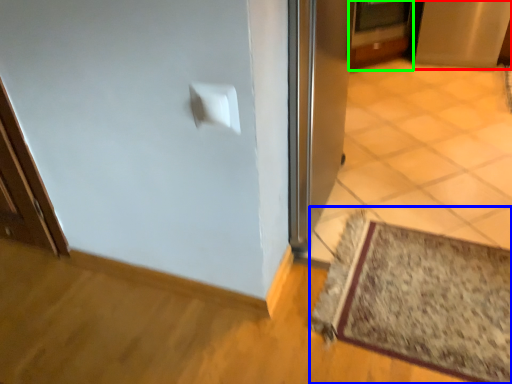
Question: Based on their relative distances, which object is nearer to screen door (highlighted by a red box)? Choose from mat (highlighted by a blue box) and door (highlighted by a green box).

Choices:
 (A) mat
 (B) door

Answer: (B)